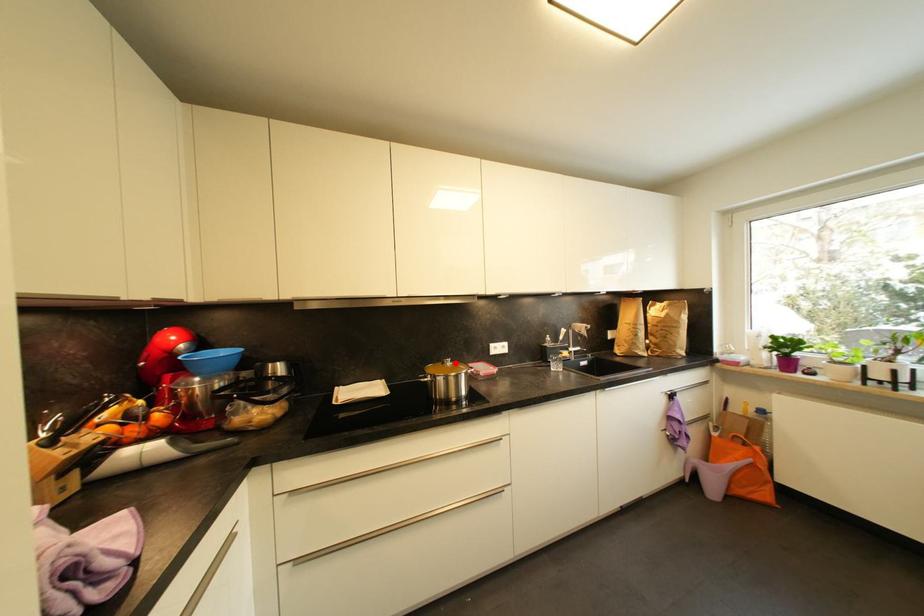
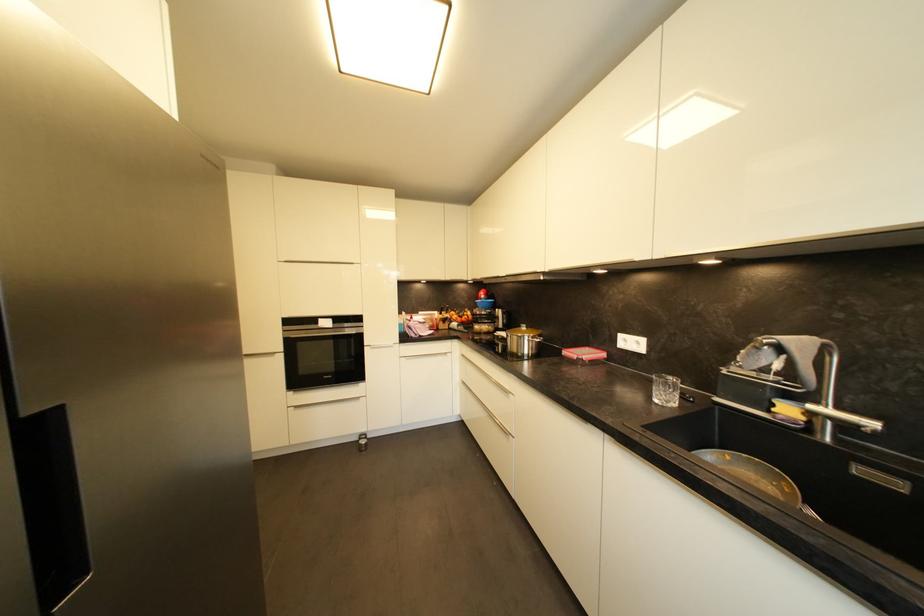
Find the pixel in the second image that matches the highlighted location in the first image.

(531, 330)